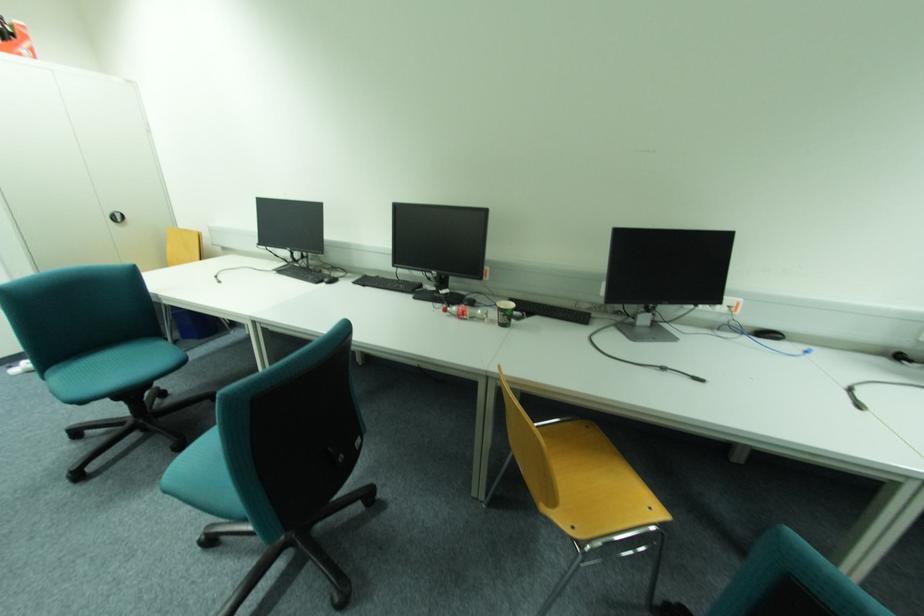
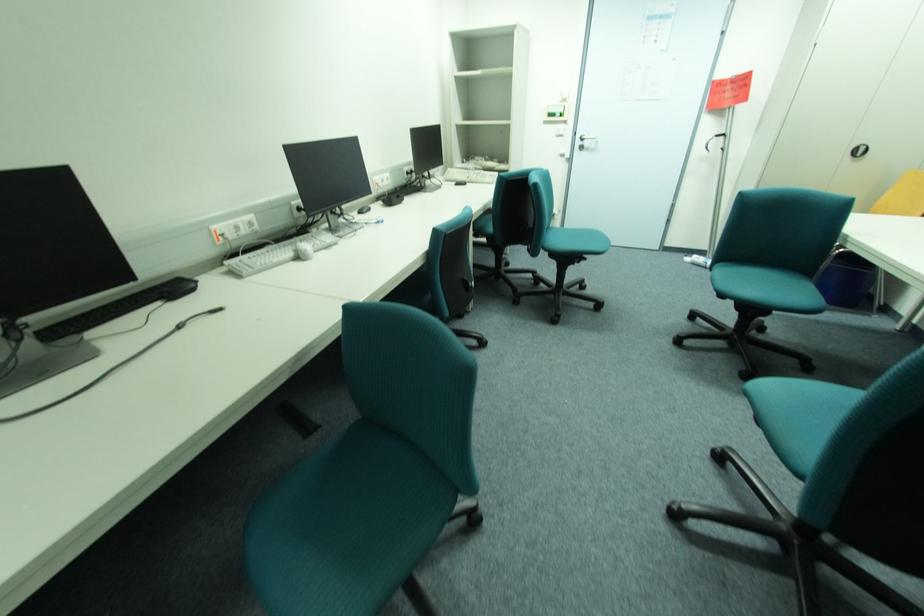
The images are taken continuously from a first-person perspective. In which direction is your viewpoint rotating?

The camera rotated toward left-down.